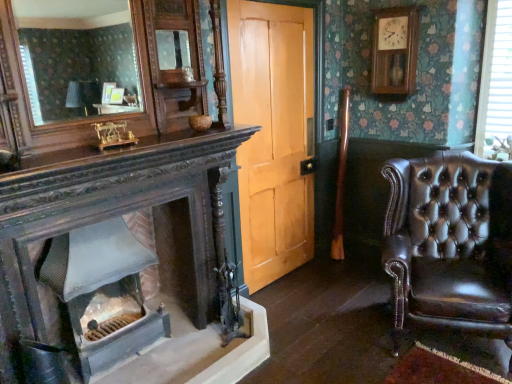
Question: Is smooth gray stone fireplace at lower left wider or thinner than light brown wood door at center?

Choices:
 (A) wide
 (B) thin

Answer: (A)

Question: Looking at the image, does smooth gray stone fireplace at lower left seem bigger or smaller compared to light brown wood door at center?

Choices:
 (A) big
 (B) small

Answer: (B)

Question: Which is farther from the smooth gray stone fireplace at lower left?

Choices:
 (A) shiny brown leather armchair at right
 (B) matte wooden mirror at upper left
 (C) white plastic blinds at upper right
 (D) light brown wood door at center

Answer: (B)

Question: Which is nearer to the smooth gray stone fireplace at lower left?

Choices:
 (A) white plastic blinds at upper right
 (B) matte wooden mirror at upper left
 (C) light brown wood door at center
 (D) shiny brown leather armchair at right

Answer: (C)